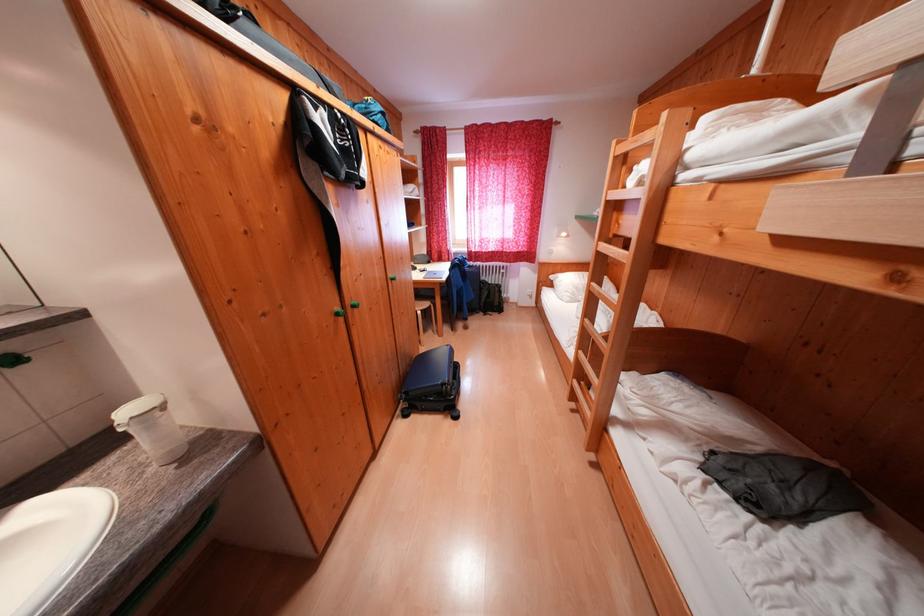
You are a GUI agent. You are given a task and a screenshot of the screen. Output one action in this format:
    pyautogui.click(x=<x>, y=<y>)
    Task: Click on the white container lid
    The image size is (924, 616).
    Given the screenshot: What is the action you would take?
    pyautogui.click(x=50, y=544)